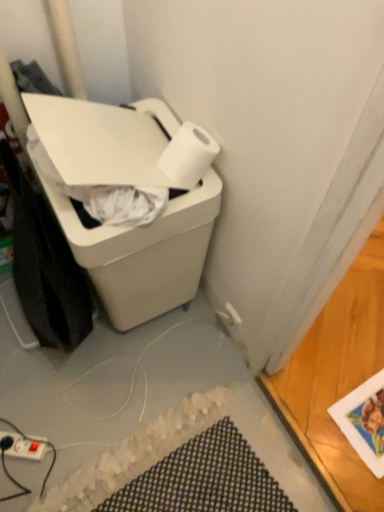
Image resolution: width=384 pixels, height=512 pixels. Find the location of `vacant space behind black textured bath mat at lower center`. vacant space behind black textured bath mat at lower center is located at coordinates (164, 366).